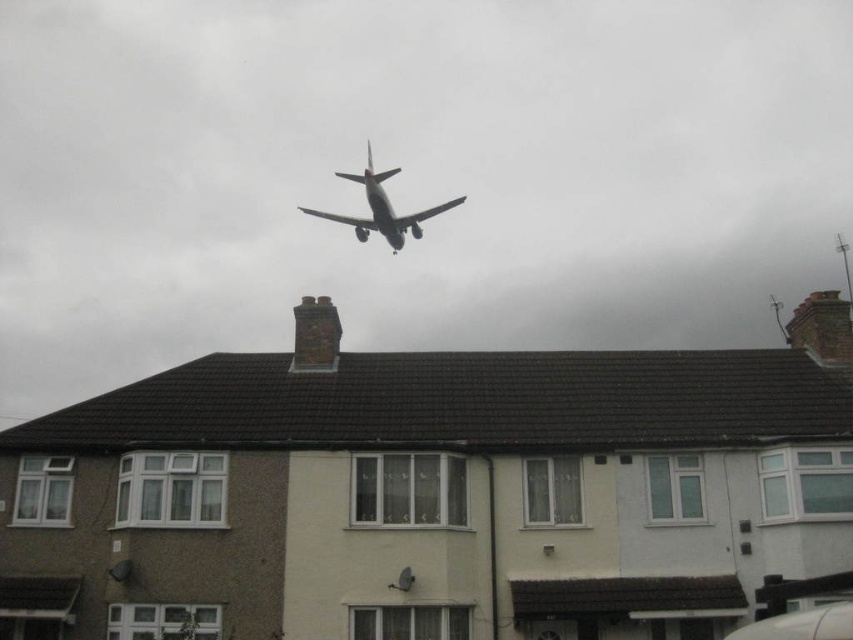
You are a pilot trying to land the silver metallic airplane at center. There is a brick chimney at upper right in your flight path. Can you safely navigate around it?

The brick chimney at upper right might be wider than the silver metallic airplane at center, so there is a risk of collision. You should adjust your flight path to ensure sufficient clearance.

You are standing at the point with coordinates point (329, 371) and want to move towards the point with coordinates point (827, 305). Since you can only move forward, will you be moving towards or away from the commercial airplane in mid flight that is preparing to land?

Point (827, 305) is further to the viewer than point (329, 371). So moving towards point (827, 305) from point (329, 371) means you are moving closer to the commercial airplane in mid flight that is preparing to land.

You are a drone operator trying to navigate your drone between the brick chimney at upper right and the commercial airplane in mid flight. Which object is closer to the top edge of the image?

The brick chimney at upper right is located at point 0.965 on the vertical axis, while the commercial airplane in mid flight is positioned centrally in the upper portion of the frame. Since 0.965 is closer to the top edge than the center, the brick chimney at upper right is closer to the top edge of the image.